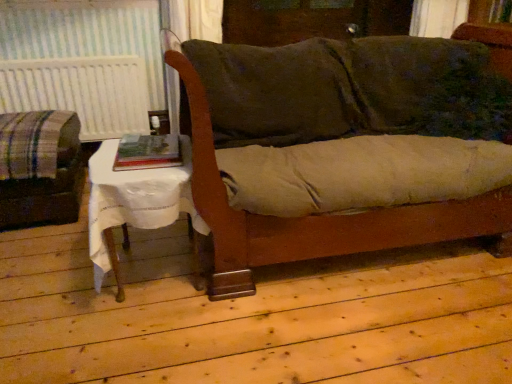
At what (x,y) coordinates should I click in order to perform the action: click on free space on the front side of white cloth-covered table at lower left. Please return your answer as a coordinate pair (x, y). This screenshot has width=512, height=384. Looking at the image, I should click on (125, 345).